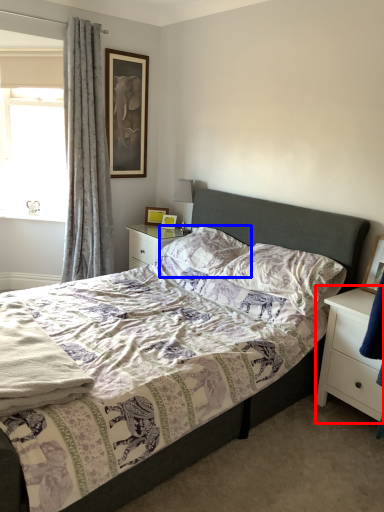
Question: Which object appears farthest to the camera in this image, nightstand (highlighted by a red box) or pillow (highlighted by a blue box)?

Choices:
 (A) nightstand
 (B) pillow

Answer: (B)